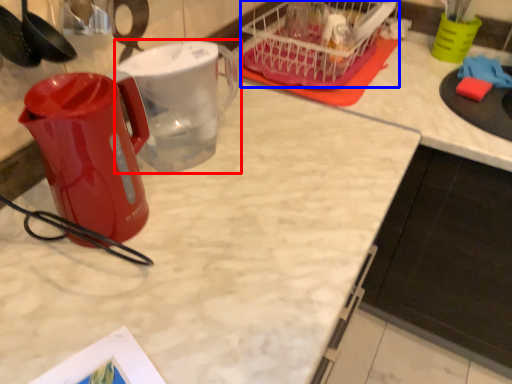
Question: Which of the following is the farthest to the observer, pitcher (highlighted by a red box) or basket (highlighted by a blue box)?

Choices:
 (A) pitcher
 (B) basket

Answer: (B)